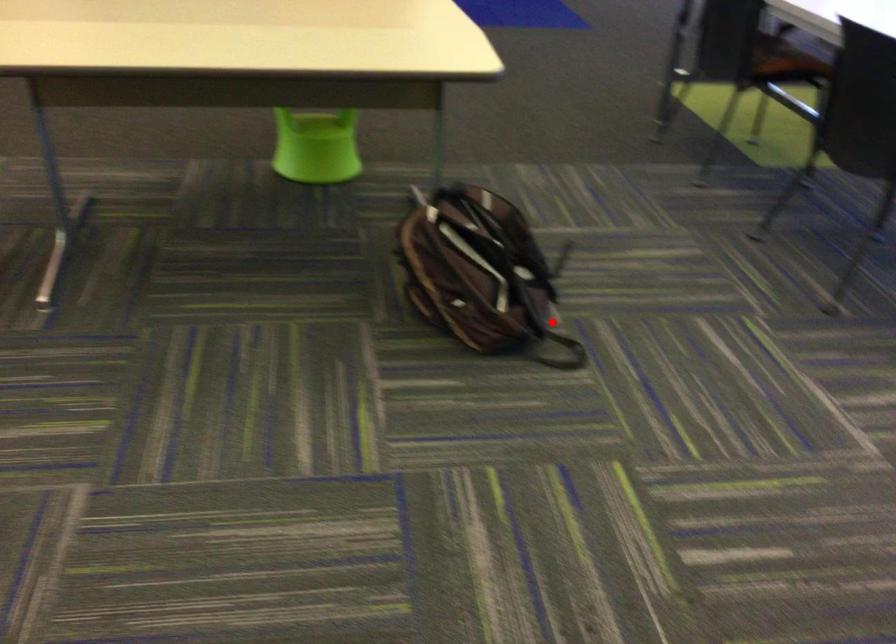
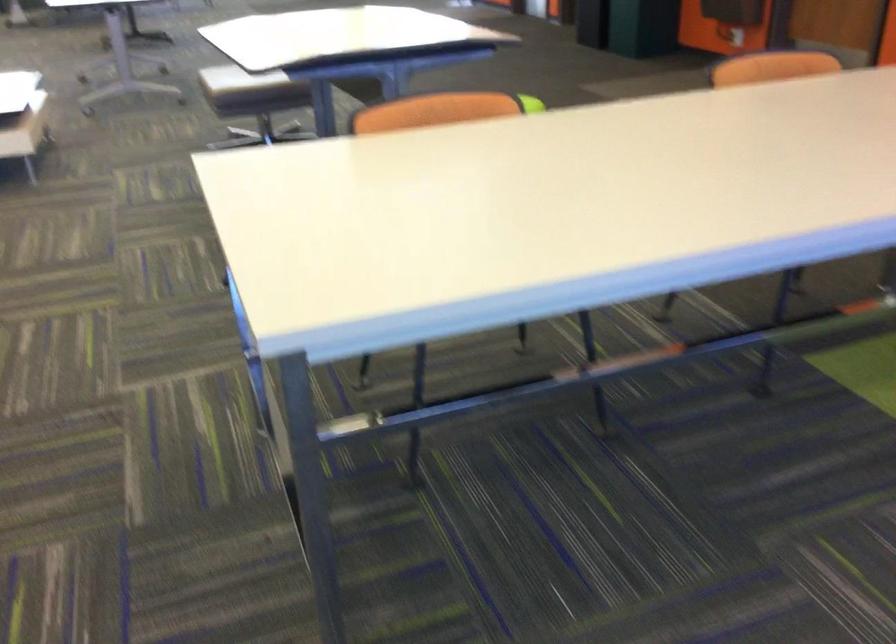
Question: I am providing you with two images of the same scene from different viewpoints. A red point is marked on the first image. Is the red point's position out of view in image 2?

Choices:
 (A) Yes
 (B) No

Answer: (A)